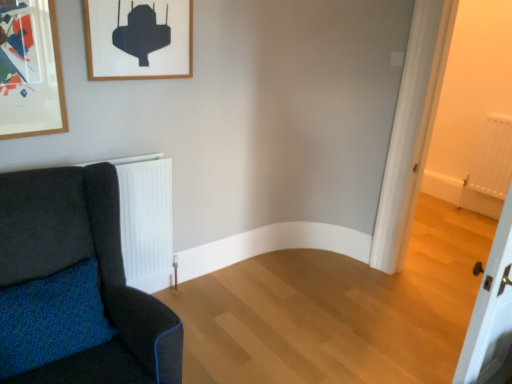
Question: Considering the positions of white matte radiator at right and velvet dark blue sofa at left in the image, is white matte radiator at right wider or thinner than velvet dark blue sofa at left?

Choices:
 (A) thin
 (B) wide

Answer: (B)

Question: Is point (475, 165) closer or farther from the camera than point (112, 377)?

Choices:
 (A) closer
 (B) farther

Answer: (B)

Question: Which of these objects is positioned closest to the velvet dark blue sofa at left?

Choices:
 (A) white matte radiator at right
 (B) wooden picture frame at upper left

Answer: (B)

Question: Which object is the farthest from the velvet dark blue sofa at left?

Choices:
 (A) wooden picture frame at upper left
 (B) white matte radiator at right

Answer: (B)